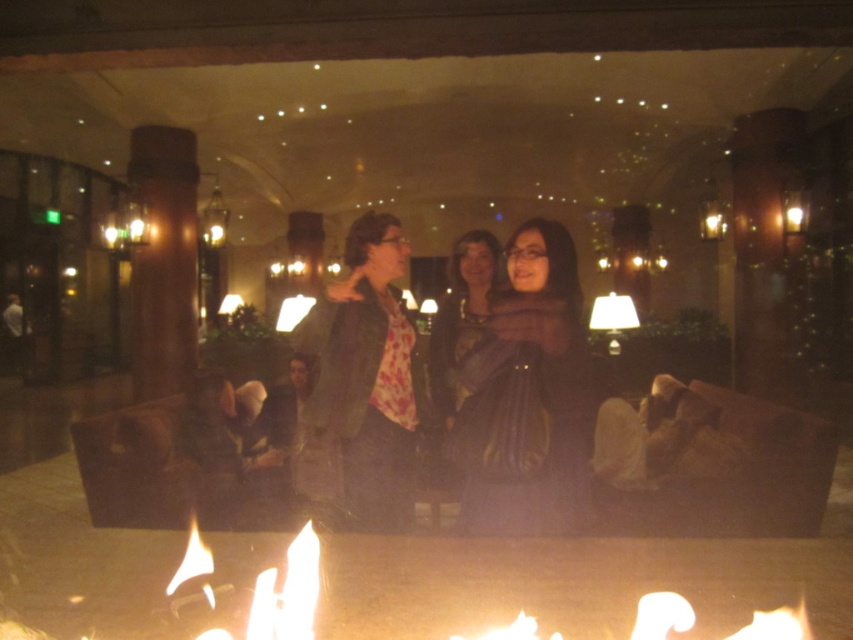
Question: Is flamefire at lower center smaller than silky black dress at center?

Choices:
 (A) no
 (B) yes

Answer: (A)

Question: Which point is closer to the camera taking this photo?

Choices:
 (A) (631, 589)
 (B) (523, 381)

Answer: (A)

Question: Which of the following is the farthest from the observer?

Choices:
 (A) (349, 358)
 (B) (595, 579)

Answer: (A)

Question: Which point is closer to the camera?

Choices:
 (A) (737, 612)
 (B) (346, 458)

Answer: (A)

Question: Can you confirm if flamefire at lower center is wider than matte black jacket at center?

Choices:
 (A) no
 (B) yes

Answer: (B)

Question: Is the position of flamefire at lower center more distant than that of silky black dress at center?

Choices:
 (A) yes
 (B) no

Answer: (B)